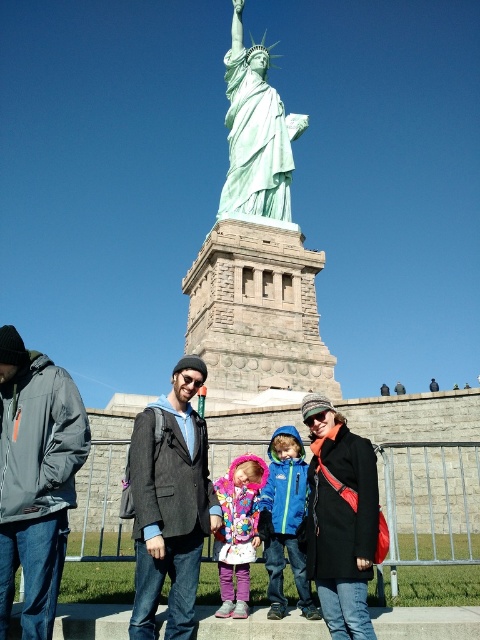
Can you confirm if matte black jacket at center is wider than dark gray woolen jacket at center?

Correct, the width of matte black jacket at center exceeds that of dark gray woolen jacket at center.

You are a GUI agent. You are given a task and a screenshot of the screen. Output one action in this format:
    pyautogui.click(x=<x>, y=<y>)
    Task: Click on the matte black jacket at center
    
    Given the screenshot: What is the action you would take?
    pyautogui.click(x=171, y=504)

Can you confirm if dark gray woolen jacket at center is positioned below black wool coat at center?

Actually, dark gray woolen jacket at center is above black wool coat at center.

Is dark gray woolen jacket at center to the left of black wool coat at center from the viewer's perspective?

Indeed, dark gray woolen jacket at center is positioned on the left side of black wool coat at center.

Is point (143, 474) farther from camera compared to point (340, 456)?

No.

Identify the location of dark gray woolen jacket at center. The image size is (480, 640). (169, 502).

How distant is matte black jacket at center from fluffy fleece jacket at center?

The distance of matte black jacket at center from fluffy fleece jacket at center is 2.50 meters.

Is matte black jacket at center wider than fluffy fleece jacket at center?

Yes, matte black jacket at center is wider than fluffy fleece jacket at center.

Locate an element on the screen. matte black jacket at center is located at coordinates (171, 504).

Locate an element on the screen. The image size is (480, 640). matte black jacket at center is located at coordinates (171, 504).